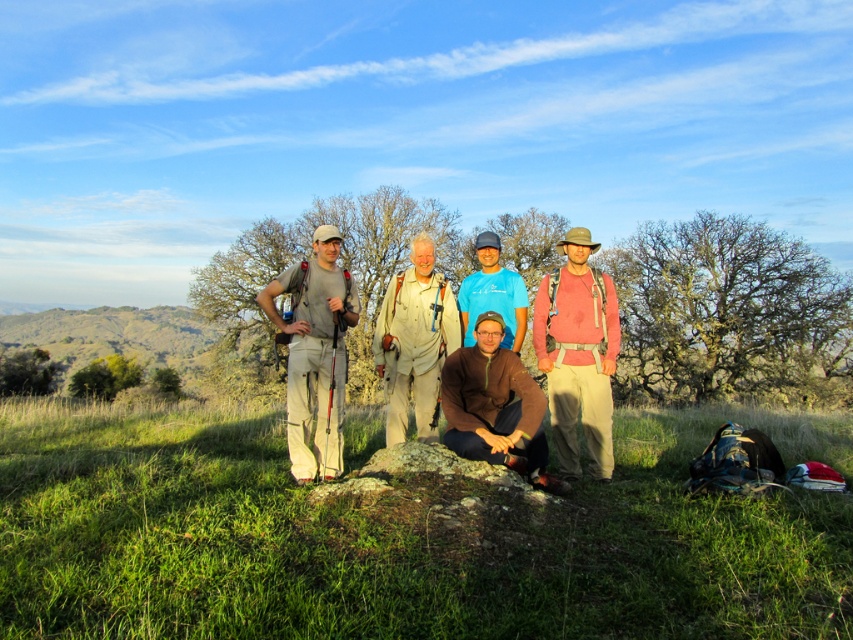
Is point (287, 371) less distant than point (520, 365)?

No, it is behind (520, 365).

Does matte gray pants at left have a larger size compared to brown matte sweater at center?

Correct, matte gray pants at left is larger in size than brown matte sweater at center.

Measure the distance between matte gray pants at left and camera.

matte gray pants at left and camera are 5.53 meters apart.

You are a GUI agent. You are given a task and a screenshot of the screen. Output one action in this format:
    pyautogui.click(x=<x>, y=<y>)
    Task: Click on the matte gray pants at left
    This screenshot has height=640, width=853.
    Given the screenshot: What is the action you would take?
    pyautogui.click(x=314, y=353)

Is brown matte sweater at center bigger than blue t-shirt at center?

Correct, brown matte sweater at center is larger in size than blue t-shirt at center.

Is brown matte sweater at center positioned behind blue t-shirt at center?

That is False.

This screenshot has width=853, height=640. What do you see at coordinates (495, 406) in the screenshot?
I see `brown matte sweater at center` at bounding box center [495, 406].

Where is `brown matte sweater at center`? brown matte sweater at center is located at coordinates (495, 406).

Can you confirm if brown matte sweater at center is positioned to the right of khaki cotton shirt at center?

Yes, brown matte sweater at center is to the right of khaki cotton shirt at center.

This screenshot has width=853, height=640. I want to click on brown matte sweater at center, so click(495, 406).

This screenshot has height=640, width=853. What do you see at coordinates (495, 406) in the screenshot?
I see `brown matte sweater at center` at bounding box center [495, 406].

The image size is (853, 640). In order to click on brown matte sweater at center in this screenshot , I will do `click(495, 406)`.